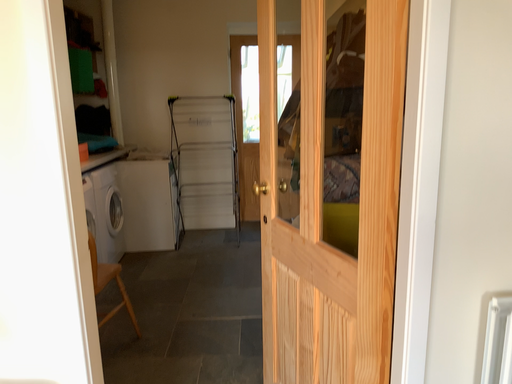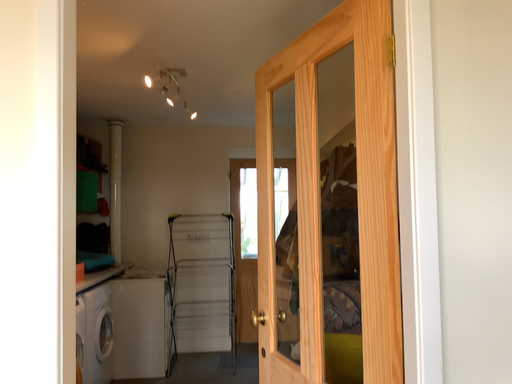
Question: Which way did the camera rotate in the video?

Choices:
 (A) rotated upward
 (B) rotated downward

Answer: (A)